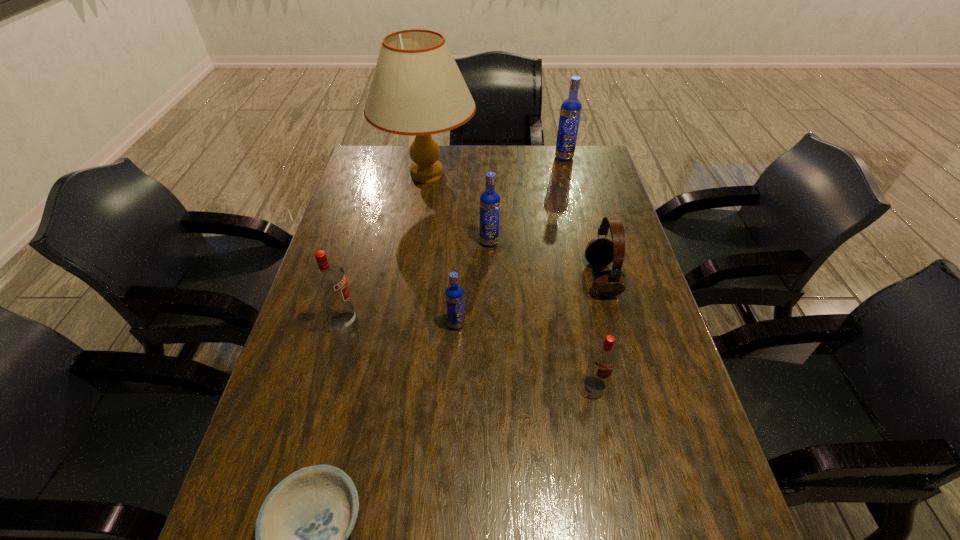
Where is `lampshade`? lampshade is located at coordinates (417, 89).

I want to click on beige lampshade, so click(417, 89).

At what (x,y) coordinates should I click in order to perform the action: click on the biggest blue vodka. Please return your answer as a coordinate pair (x, y). The height and width of the screenshot is (540, 960). Looking at the image, I should click on (571, 108).

Find the location of a particular element. The image size is (960, 540). the rightmost blue vodka is located at coordinates (571, 108).

Locate an element on the screen. The height and width of the screenshot is (540, 960). the fifth object from left to right is located at coordinates [489, 200].

Locate an element on the screen. the second smallest blue vodka is located at coordinates (489, 200).

You are a GUI agent. You are given a task and a screenshot of the screen. Output one action in this format:
    pyautogui.click(x=<x>, y=<y>)
    Task: Click on the farther red vodka
    
    Given the screenshot: What is the action you would take?
    pyautogui.click(x=329, y=281)

The height and width of the screenshot is (540, 960). Identify the location of the bigger red vodka. (329, 281).

Identify the location of black headset. 600,251.

This screenshot has width=960, height=540. In order to click on the fourth farthest object in this screenshot , I will do `click(600, 251)`.